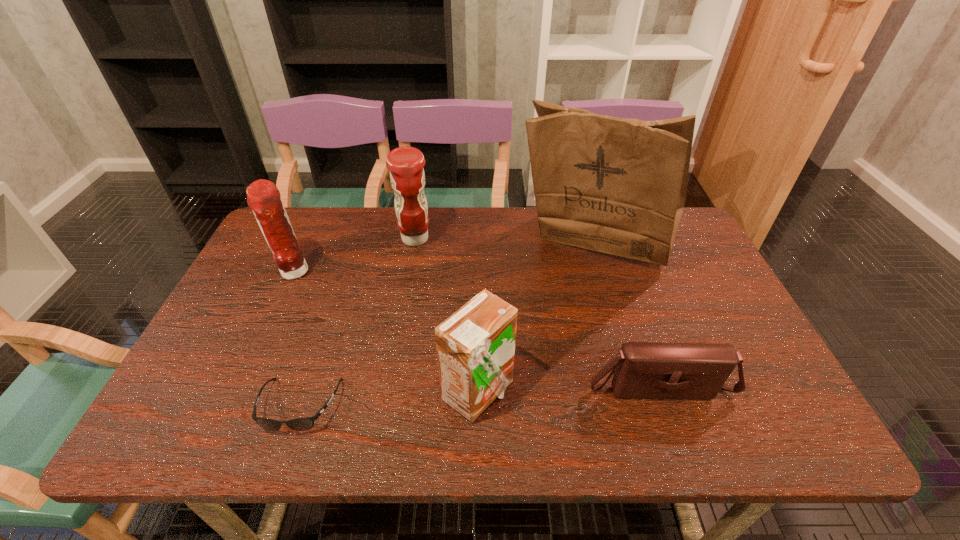
Locate an element on the screen. free point between the nearer condiment and the farther condiment is located at coordinates (354, 256).

You are a GUI agent. You are given a task and a screenshot of the screen. Output one action in this format:
    pyautogui.click(x=<x>, y=<y>)
    Task: Click on the empty space between the right condiment and the fourth tallest object
    
    Given the screenshot: What is the action you would take?
    pyautogui.click(x=446, y=316)

Find the location of `free spot between the fourth tallest object and the grocery bag`. free spot between the fourth tallest object and the grocery bag is located at coordinates (537, 320).

You are a GUI agent. You are given a task and a screenshot of the screen. Output one action in this format:
    pyautogui.click(x=<x>, y=<y>)
    Task: Click on the empty space that is in between the carton and the tallest object
    This screenshot has width=960, height=540.
    Given the screenshot: What is the action you would take?
    pyautogui.click(x=537, y=320)

Find the location of a particular element. Image resolution: width=960 pixels, height=540 pixels. blank region between the nearer condiment and the right condiment is located at coordinates pyautogui.click(x=354, y=256).

Find the location of a particular element. object that is the fourth closest to the farther condiment is located at coordinates (300, 424).

Identify which object is the second closest to the nearer condiment. Please provide its 2D coordinates. Your answer should be formatted as a tuple, i.e. [(x, y)], where the tuple contains the x and y coordinates of a point satisfying the conditions above.

[(300, 424)]